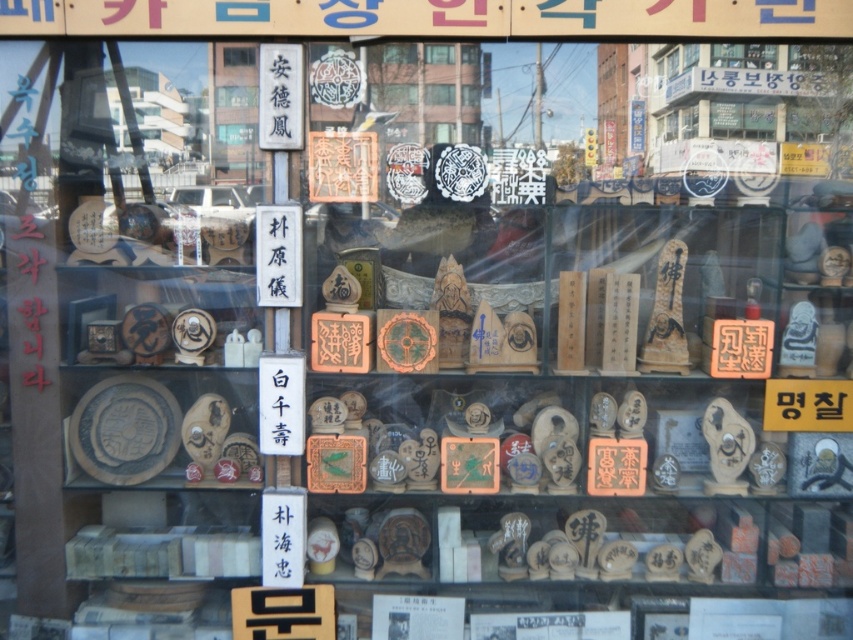
You are standing in front of the storefront window display. You see two points marked on the display at coordinates point (225, 54) and point (440, 45). Which point is closer to you?

Point (225, 54) is closer to the viewer than point (440, 45).

Based on the photo, you are standing in front of the storefront window display. You notice the transparent glass window at center and the wooden plaque at center. Which object is closer to you?

The transparent glass window at center is closer to the viewer than the wooden plaque at center.

You are a delivery person standing outside the storefront and need to hand over a package to the shopkeeper through the transparent glass window at center. Where should you position yourself to ensure the shopkeeper can see you clearly?

You should position yourself directly in front of the transparent glass window at center, which is located at point (x=239, y=54), to ensure the shopkeeper can see you clearly.